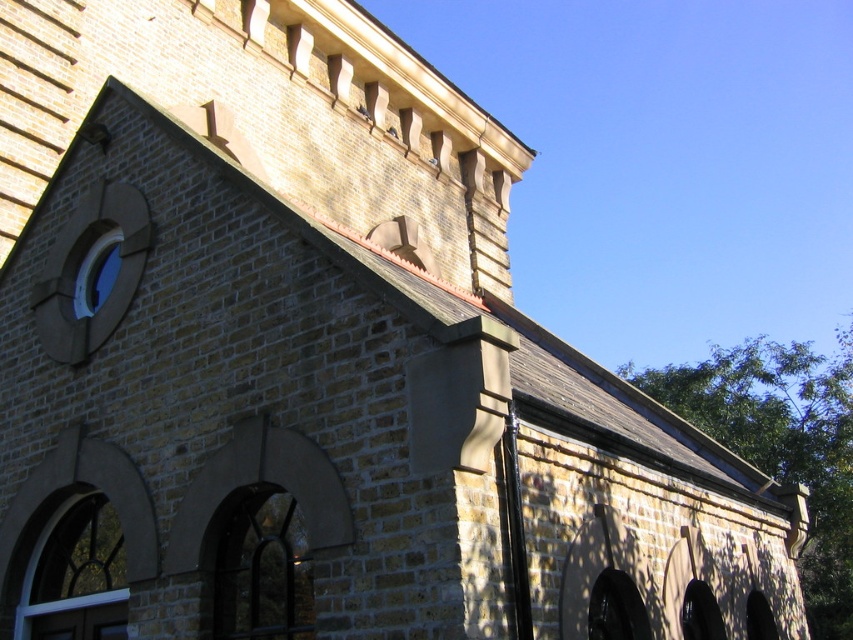
You are standing in front of the brick building and want to clean the dark glass window at lower center and the stained glass window at lower left. Which window should you clean first if you want to start from the one that is higher up?

The dark glass window at lower center is above the stained glass window at lower left, so you should clean the dark glass window at lower center first since it is higher up.

You are standing in front of a brick building and see the dark glass window at lower center and the transparent glass window at upper left. Which window is closer to you?

The dark glass window at lower center is closer to you because it is in front of the transparent glass window at upper left.

You are an architect designing a new building and want to ensure that all windows have a minimum width of 2 meters. You observe the dark glass window at lower center and the stained glass window at lower left in the image. Based on their widths, which window might not meet the requirement?

The dark glass window at lower center has a smaller width than the stained glass window at lower left, so it might not meet the 2 meter requirement if its width is below the minimum.